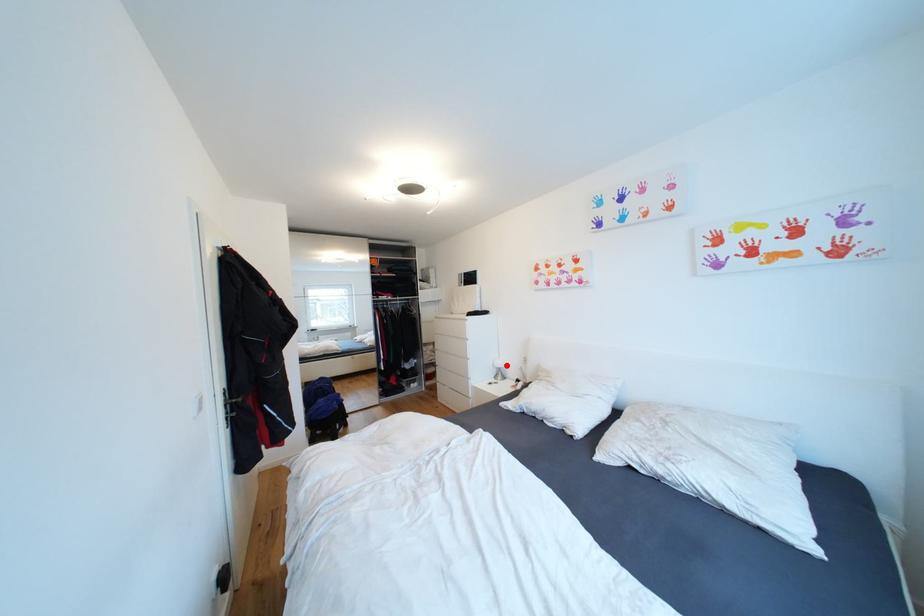
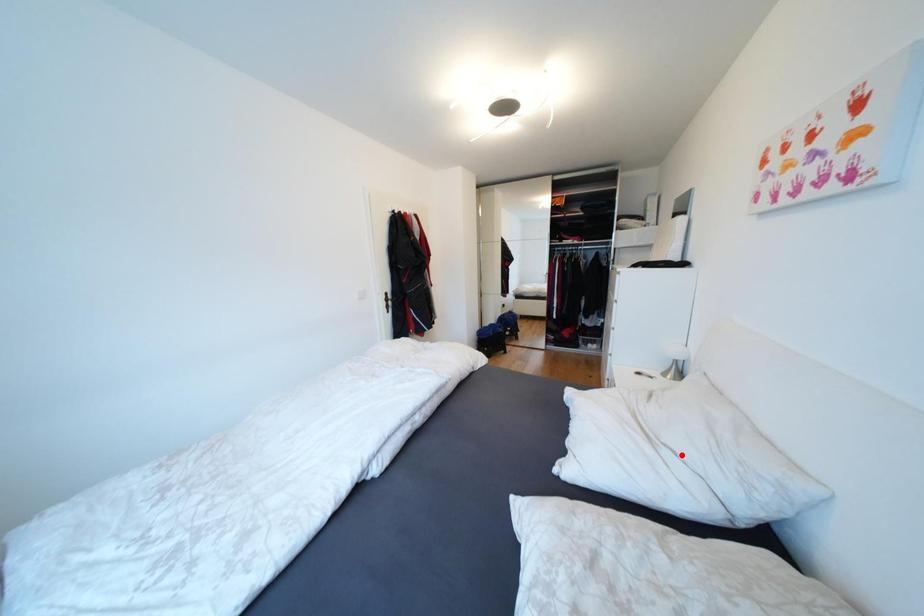
I am providing you with two images of the same scene from different viewpoints. A red point is marked on the first image and another point is marked on the second image. Do the highlighted points in image1 and image2 indicate the same real-world spot?

No